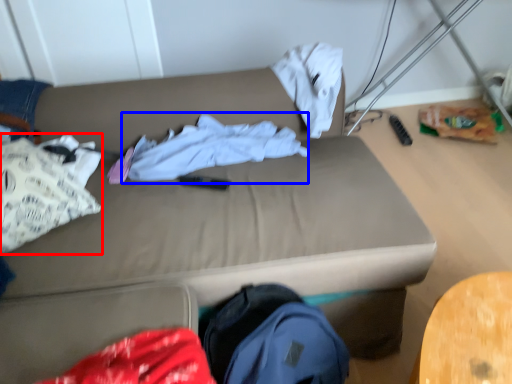
Question: Which of the following is the farthest to the observer, clothing (highlighted by a red box) or clothing (highlighted by a blue box)?

Choices:
 (A) clothing
 (B) clothing

Answer: (B)